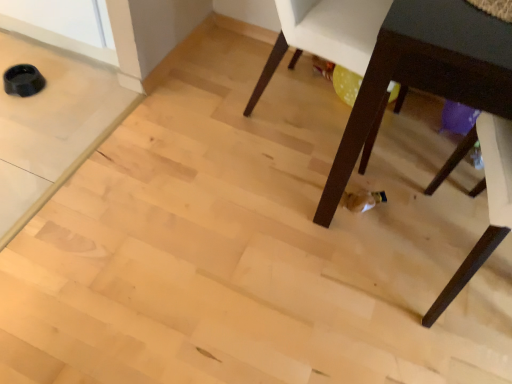
Question: Considering the positions of point (492, 213) and point (287, 8), is point (492, 213) closer or farther from the camera than point (287, 8)?

Choices:
 (A) closer
 (B) farther

Answer: (A)

Question: Considering their positions, is dark wood chair at lower right, the first chair viewed from the right, located in front of or behind white plastic chair at center, which is the first chair in top-to-bottom order?

Choices:
 (A) front
 (B) behind

Answer: (A)

Question: Estimate the real-world distances between objects in this image. Which object is closer to the dark wood table at lower right?

Choices:
 (A) white plastic chair at center, which is the 1th chair from left to right
 (B) dark wood chair at lower right, acting as the 1th chair starting from the bottom

Answer: (B)

Question: Considering the real-world distances, which object is farthest from the dark wood table at lower right?

Choices:
 (A) white plastic chair at center, which is the first chair in top-to-bottom order
 (B) dark wood chair at lower right, arranged as the 2th chair when viewed from the left

Answer: (A)